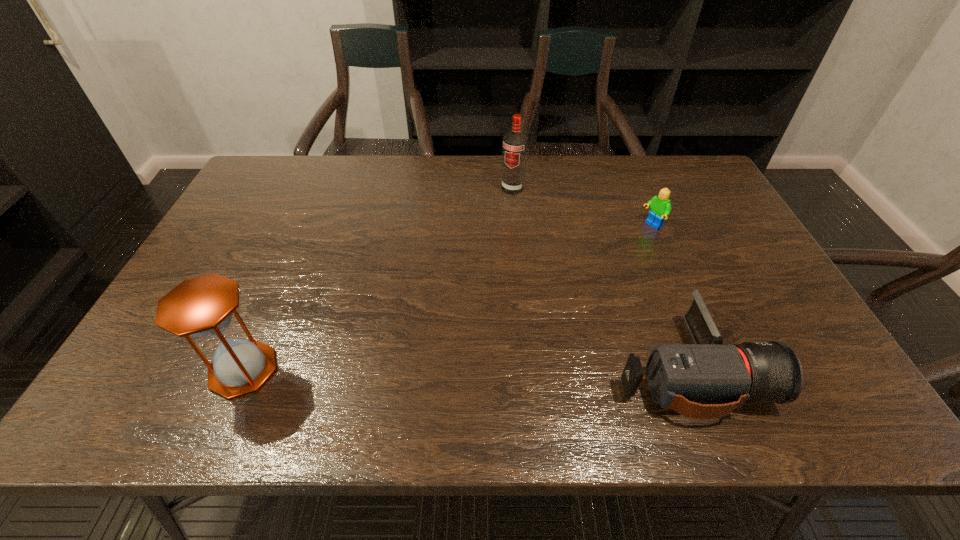
Where is `free space between the Lego and the camcorder`? free space between the Lego and the camcorder is located at coordinates (669, 297).

This screenshot has width=960, height=540. I want to click on empty space between the vodka and the third nearest object, so click(x=582, y=207).

The image size is (960, 540). Find the location of `free space between the camcorder and the hourglass`. free space between the camcorder and the hourglass is located at coordinates (465, 369).

The image size is (960, 540). In order to click on object that stands as the second closest to the camcorder in this screenshot , I will do `click(515, 143)`.

I want to click on the second closest object relative to the camcorder, so click(x=515, y=143).

Identify the location of vacant space that satisfies the following two spatial constraints: 1. on the back side of the third nearest object; 2. on the right side of the leftmost object. The width and height of the screenshot is (960, 540). (305, 226).

Where is `free space that satisfies the following two spatial constraints: 1. on the front side of the camcorder; 2. on the lens of the farthest object`? The width and height of the screenshot is (960, 540). free space that satisfies the following two spatial constraints: 1. on the front side of the camcorder; 2. on the lens of the farthest object is located at coordinates (528, 368).